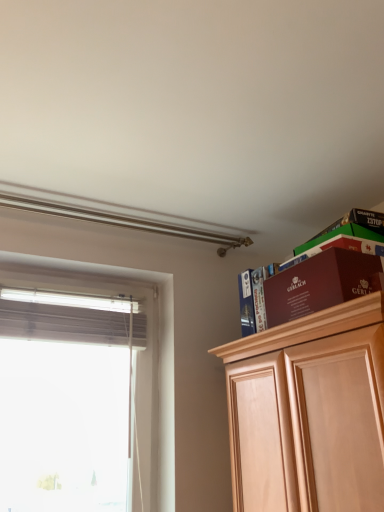
Where is `white matte window at left`? The width and height of the screenshot is (384, 512). white matte window at left is located at coordinates (77, 391).

Locate an element on the screen. maroon cardboard box at upper right is located at coordinates (326, 269).

Which of these two, matte brown book at upper right or white matte window at left, stands taller?

white matte window at left is taller.

Considering the sizes of matte brown book at upper right and white matte window at left in the image, is matte brown book at upper right bigger or smaller than white matte window at left?

Considering their sizes, matte brown book at upper right takes up less space than white matte window at left.

Is matte brown book at upper right next to white matte window at left?

There is a gap between matte brown book at upper right and white matte window at left.

In the image, is matte brown book at upper right positioned in front of or behind white matte window at left?

In the image, matte brown book at upper right appears behind white matte window at left.

From a real-world perspective, is matte brown book at upper right above or below maroon cardboard box at upper right?

matte brown book at upper right is situated higher than maroon cardboard box at upper right in the real world.

Image resolution: width=384 pixels, height=512 pixels. Identify the location of book lying below the maroon cardboard box at upper right (from the image's perspective). (253, 298).

From the image's perspective, does matte brown book at upper right appear higher than maroon cardboard box at upper right?

No, from the image's perspective, matte brown book at upper right is not above maroon cardboard box at upper right.

Consider the image. Is maroon cardboard box at upper right at the back of matte brown book at upper right?

No.

Considering the relative positions of white matte window at left and matte brown book at upper right in the image provided, is white matte window at left to the right of matte brown book at upper right from the viewer's perspective?

No, white matte window at left is not to the right of matte brown book at upper right.

What's the angular difference between white matte window at left and matte brown book at upper right's facing directions?

88.1 degrees separate the facing orientations of white matte window at left and matte brown book at upper right.

Is white matte window at left shorter than matte brown book at upper right?

Incorrect, the height of white matte window at left does not fall short of that of matte brown book at upper right.

From the picture: Is white matte window at left far away from maroon cardboard box at upper right?

Yes, white matte window at left is far from maroon cardboard box at upper right.

Does white matte window at left have a larger size compared to maroon cardboard box at upper right?

Yes.

From a real-world perspective, relative to maroon cardboard box at upper right, is white matte window at left vertically above or below?

white matte window at left is situated lower than maroon cardboard box at upper right in the real world.

Does white matte window at left have a greater height compared to maroon cardboard box at upper right?

Correct, white matte window at left is much taller as maroon cardboard box at upper right.

Can you confirm if maroon cardboard box at upper right is positioned to the right of matte brown book at upper right?

Yes.

From a real-world perspective, is maroon cardboard box at upper right physically located above or below matte brown book at upper right?

From a real-world perspective, maroon cardboard box at upper right is physically below matte brown book at upper right.

Which of these two, maroon cardboard box at upper right or matte brown book at upper right, is bigger?

maroon cardboard box at upper right.

Based on the photo, is maroon cardboard box at upper right turned away from matte brown book at upper right?

No, matte brown book at upper right is not at the back of maroon cardboard box at upper right.

Between maroon cardboard box at upper right and white matte window at left, which one appears on the right side from the viewer's perspective?

From the viewer's perspective, maroon cardboard box at upper right appears more on the right side.

From the picture: Is maroon cardboard box at upper right completely or partially outside of white matte window at left?

Yes, maroon cardboard box at upper right is outside of white matte window at left.

From the picture: How much distance is there between maroon cardboard box at upper right and white matte window at left?

The distance of maroon cardboard box at upper right from white matte window at left is 1.08 meters.

Looking at this image, which of these two, maroon cardboard box at upper right or white matte window at left, is thinner?

With smaller width is white matte window at left.

This screenshot has width=384, height=512. Find the location of `book located above the white matte window at left (from the image's perspective)`. book located above the white matte window at left (from the image's perspective) is located at coordinates (253, 298).

This screenshot has height=512, width=384. Find the location of `shelf located underneath the matte brown book at upper right (from a real-world perspective)`. shelf located underneath the matte brown book at upper right (from a real-world perspective) is located at coordinates (326, 269).

From the image, which object appears to be nearer to maroon cardboard box at upper right, matte brown book at upper right or white matte window at left?

matte brown book at upper right lies closer to maroon cardboard box at upper right than the other object.

From the picture: Considering their positions, is maroon cardboard box at upper right positioned further to white matte window at left than matte brown book at upper right?

maroon cardboard box at upper right is further to white matte window at left.

When comparing their distances from white matte window at left, does matte brown book at upper right or maroon cardboard box at upper right seem further?

Based on the image, maroon cardboard box at upper right appears to be further to white matte window at left.

From the image, which object appears to be farther from maroon cardboard box at upper right, white matte window at left or matte brown book at upper right?

white matte window at left is further to maroon cardboard box at upper right.

When comparing their distances from matte brown book at upper right, does maroon cardboard box at upper right or white matte window at left seem closer?

Among the two, maroon cardboard box at upper right is located nearer to matte brown book at upper right.

Considering their positions, is white matte window at left positioned further to matte brown book at upper right than maroon cardboard box at upper right?

white matte window at left lies further to matte brown book at upper right than the other object.

What are the coordinates of `book situated between white matte window at left and maroon cardboard box at upper right from left to right` in the screenshot? It's located at (253, 298).